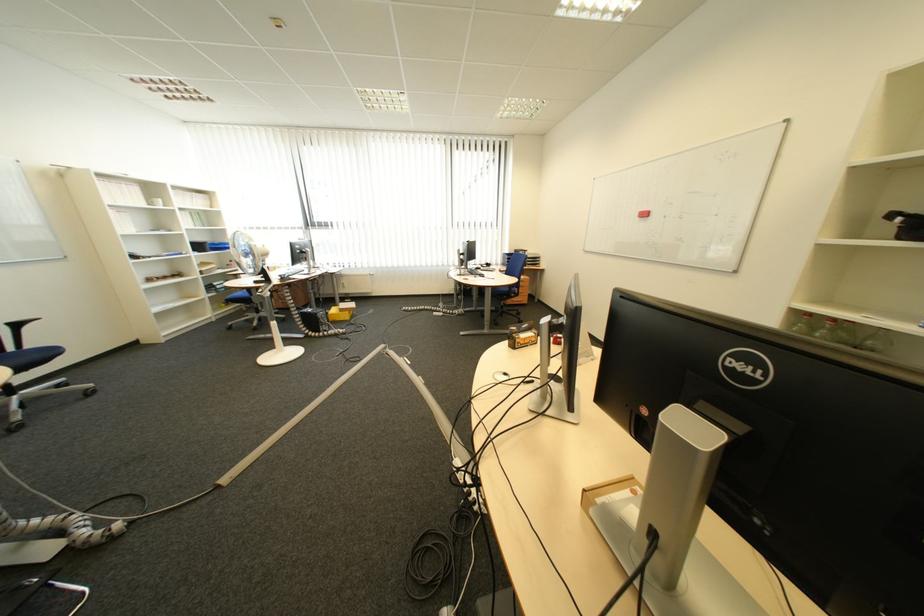
Locate an element on the screen. This screenshot has height=616, width=924. yellow cardboard box is located at coordinates (341, 310).